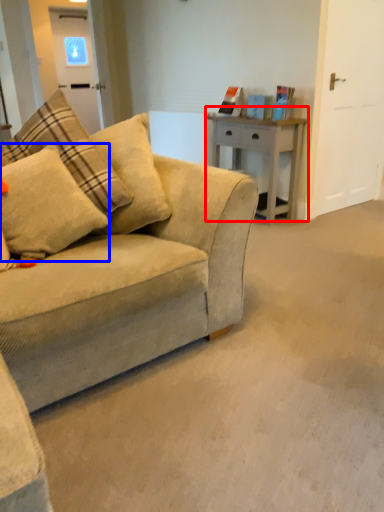
Question: Which of the following is the closest to the observer, table (highlighted by a red box) or pillow (highlighted by a blue box)?

Choices:
 (A) table
 (B) pillow

Answer: (B)